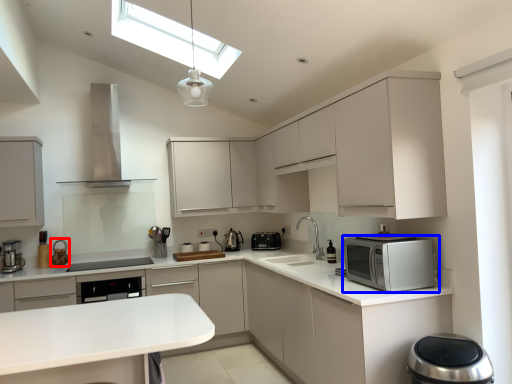
Question: Which of the following is the farthest to the observer, appliance (highlighted by a red box) or home appliance (highlighted by a blue box)?

Choices:
 (A) appliance
 (B) home appliance

Answer: (A)